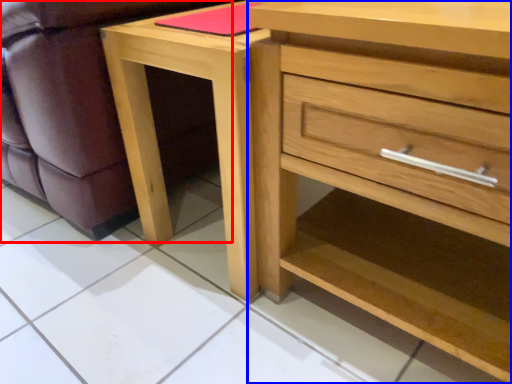
Question: Which point is closer to the camera, swivel chair (highlighted by a red box) or chest of drawers (highlighted by a blue box)?

Choices:
 (A) swivel chair
 (B) chest of drawers

Answer: (B)